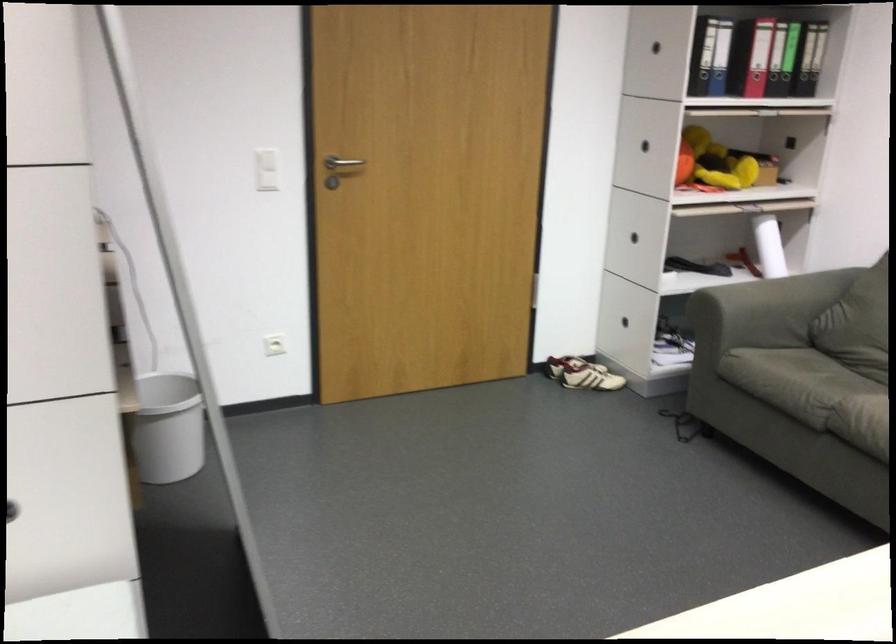
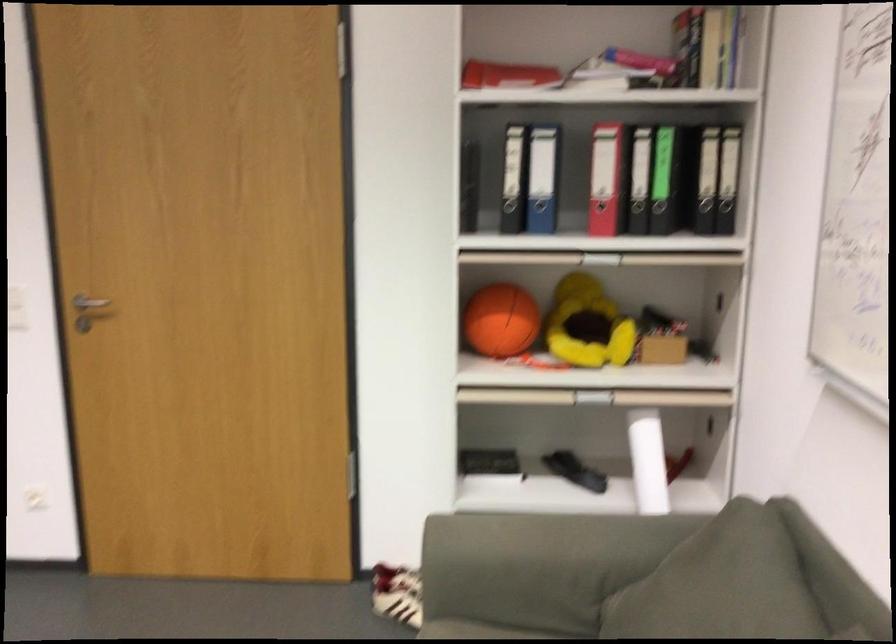
In the second image, find the point that corresponds to point (298, 154) in the first image.

(88, 305)